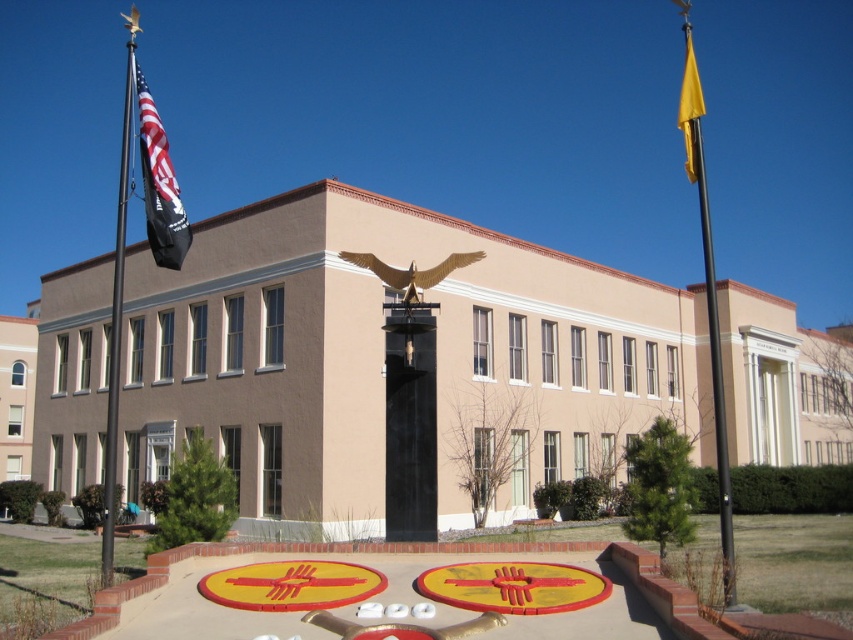
Does black metal flag pole at upper right appear under yellow fabric flag at upper right?

Yes, black metal flag pole at upper right is below yellow fabric flag at upper right.

Which is behind, point (724, 509) or point (695, 176)?

Positioned behind is point (695, 176).

Locate an element on the screen. black metal flag pole at upper right is located at coordinates tap(706, 291).

Locate an element on the screen. The image size is (853, 640). black metal flag pole at upper right is located at coordinates tap(706, 291).

Is black metal flag pole at left taller than yellow fabric flag at upper right?

Yes, black metal flag pole at left is taller than yellow fabric flag at upper right.

Does black metal flag pole at left have a greater width compared to yellow fabric flag at upper right?

Yes, black metal flag pole at left is wider than yellow fabric flag at upper right.

Is point (117, 300) positioned behind point (689, 170)?

That is True.

This screenshot has height=640, width=853. I want to click on black metal flag pole at left, so click(x=115, y=328).

Is matte black flag at left thinner than black metal flag pole at left?

Yes.

Between point (151, 125) and point (112, 534), which one is positioned in front?

Positioned in front is point (112, 534).

Where is `matte black flag at left`? The width and height of the screenshot is (853, 640). matte black flag at left is located at coordinates (160, 182).